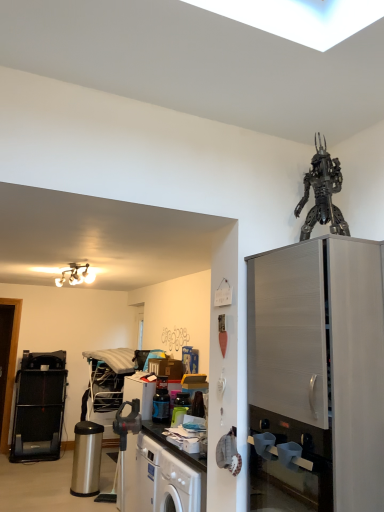
Question: From a real-world perspective, is metallic robot at upper right positioned above or below metallic/reflective chandelier at upper left?

Choices:
 (A) below
 (B) above

Answer: (B)

Question: From the image's perspective, is metallic robot at upper right positioned above or below metallic/reflective chandelier at upper left?

Choices:
 (A) above
 (B) below

Answer: (A)

Question: Which of these objects is positioned closest to the black plastic treadmill at left, which ranks as the third appliance in right-to-left order?

Choices:
 (A) metallic robot at upper right
 (B) stainless steel trash can at lower left, the 2th appliance in the left-to-right sequence
 (C) metallic blue blender at center, the 1th appliance when ordered from right to left
 (D) satin silver cabinet at right
 (E) metallic/reflective chandelier at upper left

Answer: (B)

Question: Which object is positioned farthest from the metallic blue blender at center, the 1th appliance when ordered from right to left?

Choices:
 (A) metallic/reflective chandelier at upper left
 (B) black plastic treadmill at left, which ranks as the third appliance in right-to-left order
 (C) satin silver cabinet at right
 (D) metallic robot at upper right
 (E) stainless steel trash can at lower left, the 2th appliance in the left-to-right sequence

Answer: (B)